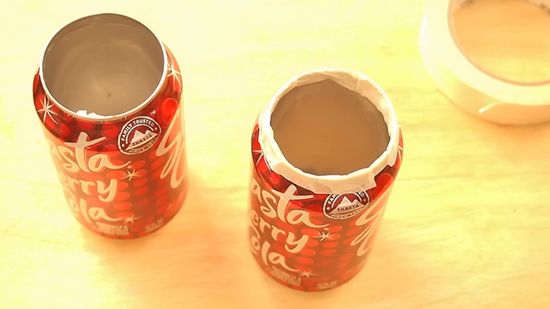
What are the coordinates of `wood table` in the screenshot? It's located at (471, 227).